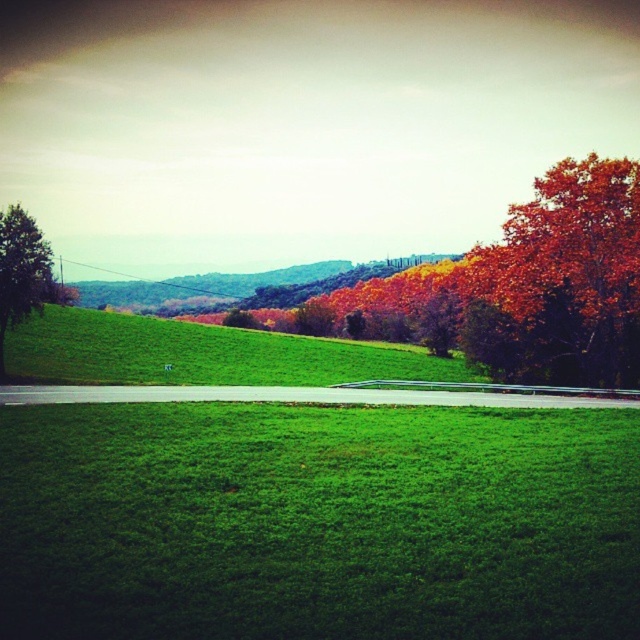
Question: Which object is closer to the camera taking this photo?

Choices:
 (A) green leafy tree at left
 (B) shiny red leaves at right
 (C) green grassy field at lower center
 (D) autumn foliage at upper right

Answer: (C)

Question: Which object is farther from the camera taking this photo?

Choices:
 (A) green leafy tree at center
 (B) shiny red leaves at right

Answer: (A)

Question: Among these objects, which one is farthest from the camera?

Choices:
 (A) shiny red leaves at right
 (B) green leafy tree at left

Answer: (A)

Question: Can you confirm if green grassy field at lower center is thinner than green leafy tree at left?

Choices:
 (A) no
 (B) yes

Answer: (A)

Question: Can you confirm if shiny red leaves at right is wider than green leafy tree at center?

Choices:
 (A) no
 (B) yes

Answer: (B)

Question: Is green grassy field at lower center to the left of shiny red leaves at right from the viewer's perspective?

Choices:
 (A) yes
 (B) no

Answer: (A)